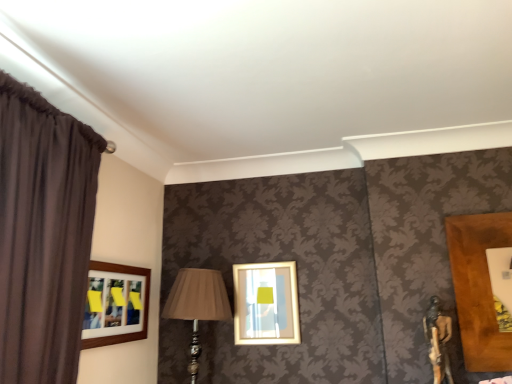
Question: Are dark brown fabric curtain at left and wooden-framed picture at left, placed as the second picture frame when sorted from right to left, located far from each other?

Choices:
 (A) no
 (B) yes

Answer: (A)

Question: Is dark brown fabric curtain at left beside wooden-framed picture at left, placed as the second picture frame when sorted from right to left?

Choices:
 (A) no
 (B) yes

Answer: (A)

Question: Is dark brown fabric curtain at left not inside wooden-framed picture at left, placed as the 1th picture frame when sorted from left to right?

Choices:
 (A) yes
 (B) no

Answer: (A)

Question: Is the depth of dark brown fabric curtain at left greater than that of wooden-framed picture at left, placed as the 1th picture frame when sorted from left to right?

Choices:
 (A) yes
 (B) no

Answer: (B)

Question: From the image's perspective, is dark brown fabric curtain at left under wooden-framed picture at left, placed as the second picture frame when sorted from right to left?

Choices:
 (A) no
 (B) yes

Answer: (A)

Question: Can you confirm if dark brown fabric curtain at left is smaller than wooden-framed picture at left, placed as the second picture frame when sorted from right to left?

Choices:
 (A) yes
 (B) no

Answer: (B)

Question: From a real-world perspective, is matte beige fabric at center on dark brown fabric curtain at left?

Choices:
 (A) yes
 (B) no

Answer: (B)

Question: Considering the relative sizes of matte beige fabric at center and dark brown fabric curtain at left in the image provided, is matte beige fabric at center bigger than dark brown fabric curtain at left?

Choices:
 (A) no
 (B) yes

Answer: (A)

Question: Is matte beige fabric at center positioned with its back to dark brown fabric curtain at left?

Choices:
 (A) no
 (B) yes

Answer: (A)

Question: From the image's perspective, does matte beige fabric at center appear higher than dark brown fabric curtain at left?

Choices:
 (A) yes
 (B) no

Answer: (B)

Question: From a real-world perspective, is matte beige fabric at center under dark brown fabric curtain at left?

Choices:
 (A) no
 (B) yes

Answer: (B)

Question: Is dark brown fabric curtain at left surrounded by matte beige fabric at center?

Choices:
 (A) yes
 (B) no

Answer: (B)

Question: Is wooden-framed picture at left, placed as the 1th picture frame when sorted from left to right, inside matte beige fabric at center?

Choices:
 (A) yes
 (B) no

Answer: (B)